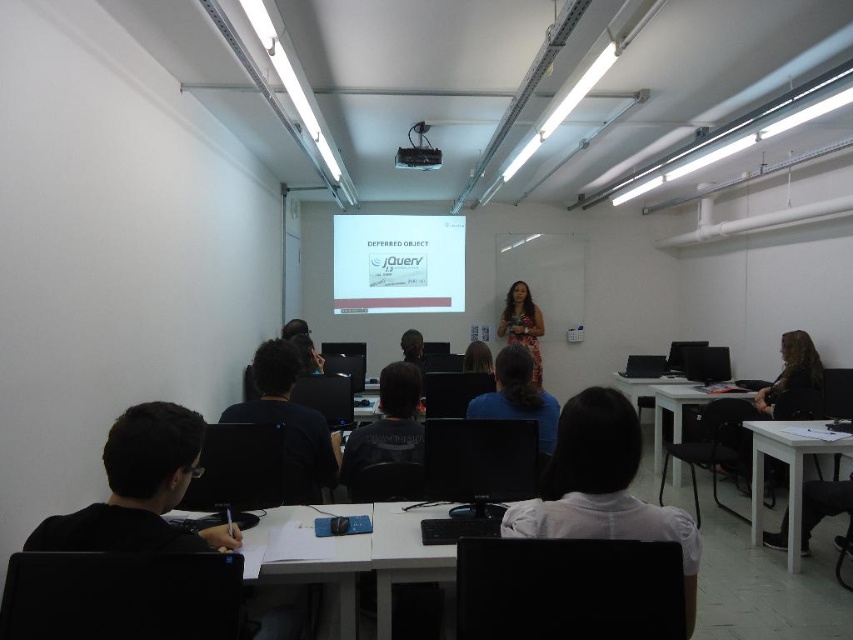
Describe the element at coordinates (518, 396) in the screenshot. Image resolution: width=853 pixels, height=640 pixels. I see `blue fabric shirt at center` at that location.

Based on the photo, which is below, blue fabric shirt at center or dark brown leather jacket at center?

blue fabric shirt at center is below.

Where is `blue fabric shirt at center`? The height and width of the screenshot is (640, 853). blue fabric shirt at center is located at coordinates (518, 396).

This screenshot has height=640, width=853. Identify the location of blue fabric shirt at center. (518, 396).

Is white glossy table at lower right above dark brown hair at center?

Incorrect, white glossy table at lower right is not positioned above dark brown hair at center.

Is point (796, 554) farther from viewer compared to point (483, 349)?

No, (796, 554) is closer to viewer.

Does point (793, 445) come behind point (468, 365)?

No.

I want to click on white glossy table at lower right, so click(788, 468).

Who is taller, blue fabric shirt at center or dark brown hair at center?

blue fabric shirt at center is taller.

Is blue fabric shirt at center further to the viewer compared to dark brown hair at center?

That is False.

The height and width of the screenshot is (640, 853). Find the location of `blue fabric shirt at center`. blue fabric shirt at center is located at coordinates (518, 396).